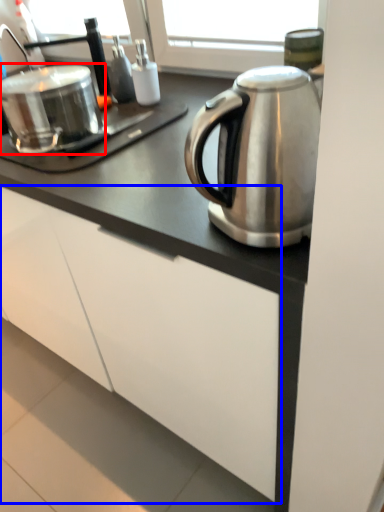
Question: Among these objects, which one is farthest to the camera, appliance (highlighted by a red box) or cabinetry (highlighted by a blue box)?

Choices:
 (A) appliance
 (B) cabinetry

Answer: (A)